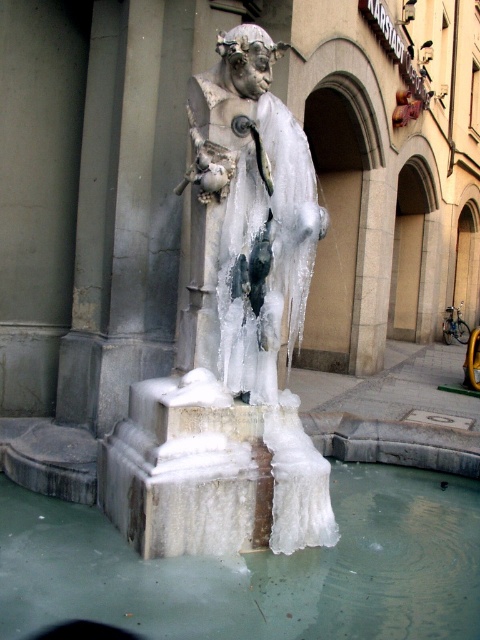
Question: Is clear ice water at center below icy stone statue at center?

Choices:
 (A) yes
 (B) no

Answer: (A)

Question: Can you confirm if white frosted statue at center is positioned to the left of clear ice water at center?

Choices:
 (A) no
 (B) yes

Answer: (B)

Question: Can you confirm if white frosted statue at center is bigger than clear ice water at center?

Choices:
 (A) no
 (B) yes

Answer: (B)

Question: Which object appears farthest from the camera in this image?

Choices:
 (A) icy stone statue at center
 (B) clear ice water at center

Answer: (A)

Question: Which is nearer to the clear ice water at center?

Choices:
 (A) white frosted statue at center
 (B) icy stone statue at center

Answer: (A)

Question: Estimate the real-world distances between objects in this image. Which object is farther from the clear ice water at center?

Choices:
 (A) white frosted statue at center
 (B) icy stone statue at center

Answer: (B)